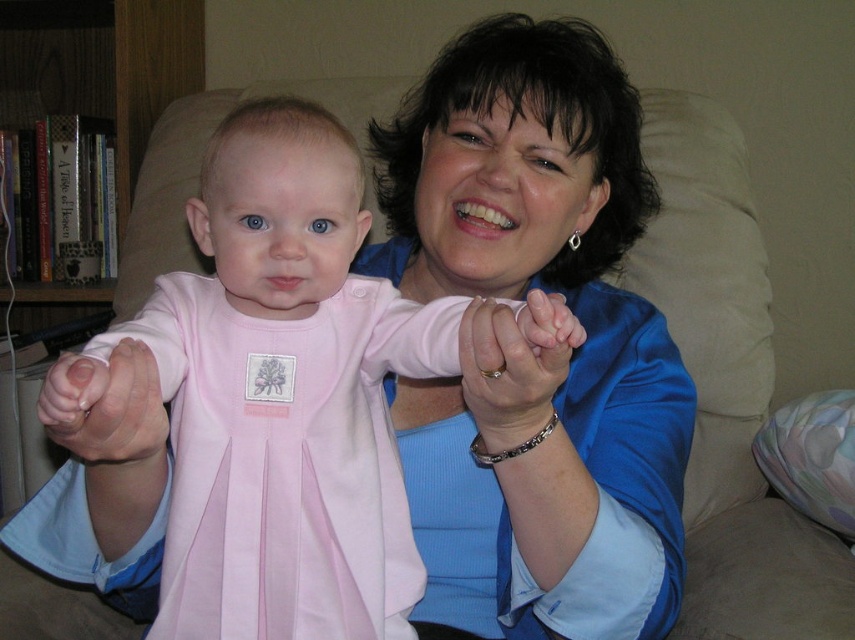
Question: Does smooth skin hand at center come in front of pink fabric baby hand at center?

Choices:
 (A) no
 (B) yes

Answer: (A)

Question: Considering the real-world distances, which object is farthest from the smooth skin hand at center?

Choices:
 (A) pink fabric baby hand at center
 (B) pink satin dress at center

Answer: (A)

Question: Does smooth skin hand at center have a larger size compared to pink fabric baby hand at center?

Choices:
 (A) yes
 (B) no

Answer: (B)

Question: Is pink satin dress at center wider than smooth skin hand at center?

Choices:
 (A) yes
 (B) no

Answer: (A)

Question: Which of the following is the closest to the observer?

Choices:
 (A) smooth skin hand at center
 (B) pink fabric baby hand at center
 (C) pink satin dress at center

Answer: (B)

Question: Among these objects, which one is nearest to the camera?

Choices:
 (A) smooth skin hand at center
 (B) pink fabric baby hand at center

Answer: (B)